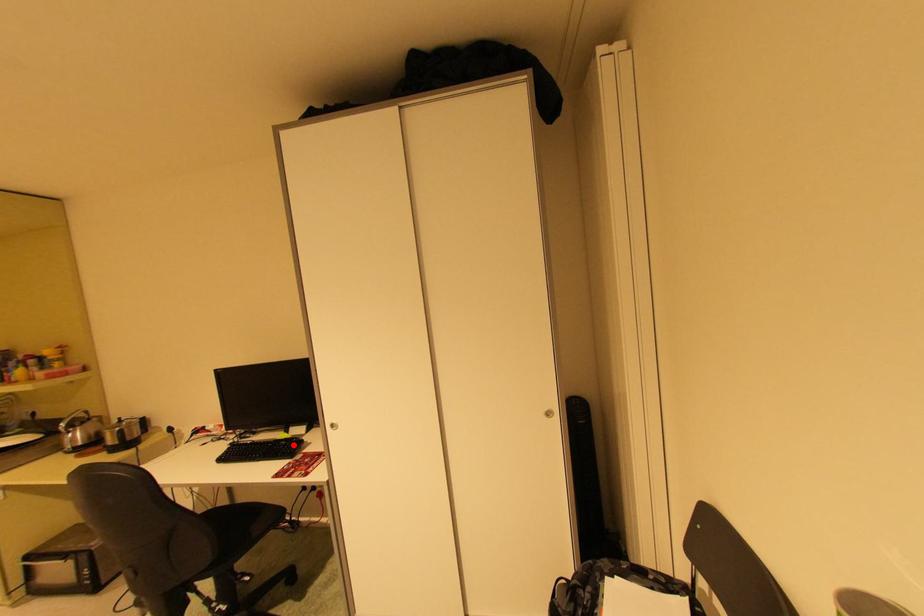
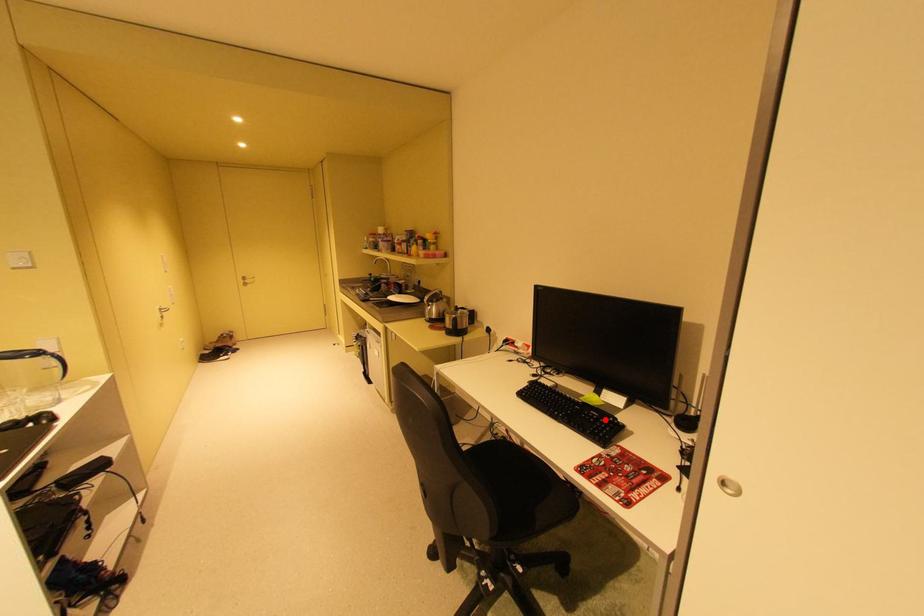
I am providing you with two images of the same scene from different viewpoints. A red point is marked on the first image and another point is marked on the second image. Is the marked point in image1 the same physical position as the marked point in image2?

Yes